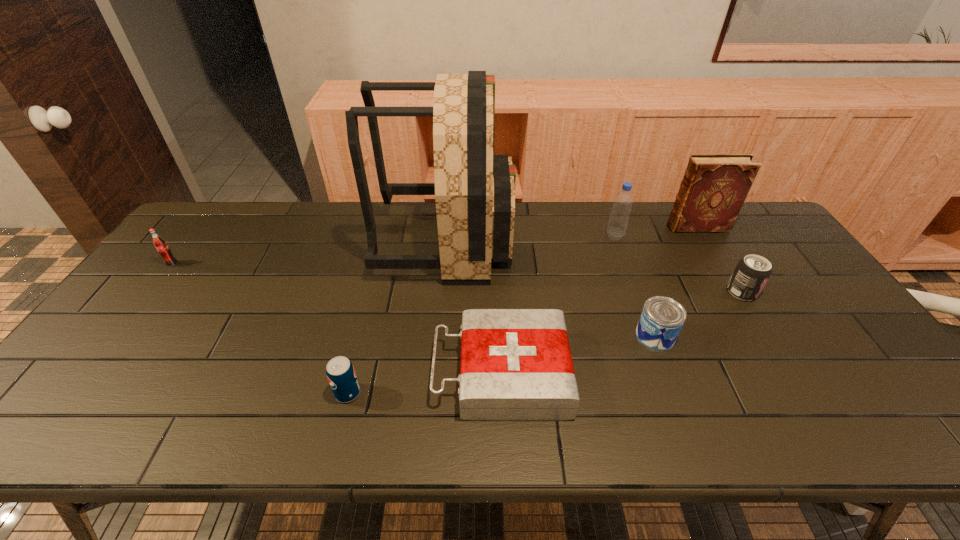
Locate an element on the screen. This screenshot has height=540, width=960. vacant region at the far edge is located at coordinates (681, 237).

You are a GUI agent. You are given a task and a screenshot of the screen. Output one action in this format:
    pyautogui.click(x=<x>, y=<y>)
    Task: Click on the vacant space at the near edge
    The width and height of the screenshot is (960, 540).
    Given the screenshot: What is the action you would take?
    pyautogui.click(x=430, y=442)

The width and height of the screenshot is (960, 540). Find the location of `vacant space at the left edge`. vacant space at the left edge is located at coordinates (116, 390).

This screenshot has height=540, width=960. What are the coordinates of `free space at the right edge of the desktop` in the screenshot? It's located at (808, 285).

In the image, there is a desktop. In order to click on vacant space at the far left corner in this screenshot , I will do `click(203, 237)`.

Where is `blank space at the near left corner of the desktop`? The image size is (960, 540). blank space at the near left corner of the desktop is located at coordinates (83, 406).

In order to click on vacant space at the near right corner of the desktop in this screenshot , I will do `click(919, 416)`.

This screenshot has width=960, height=540. Find the location of `empty location between the rightmost pop and the sixth shortest object`. empty location between the rightmost pop and the sixth shortest object is located at coordinates (678, 264).

Locate an element on the screen. The height and width of the screenshot is (540, 960). empty space that is in between the tallest object and the first-aid kit is located at coordinates (474, 307).

What are the coordinates of `free space between the second farthest pop and the can` in the screenshot? It's located at (698, 314).